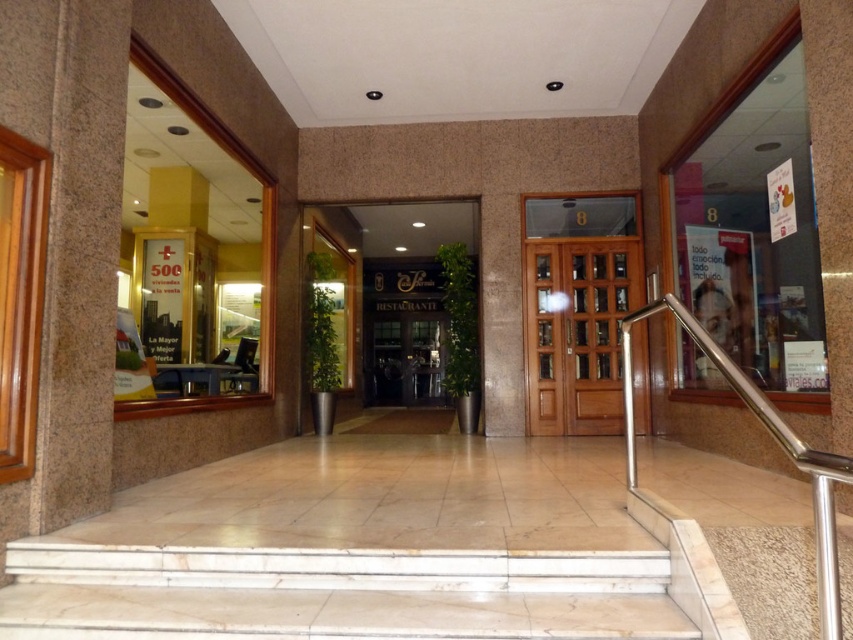
Question: Among these objects, which one is nearest to the camera?

Choices:
 (A) dark brown wooden door at center
 (B) granite pillar at left
 (C) polished stainless steel handrail at right

Answer: (C)

Question: Among these points, which one is nearest to the camera?

Choices:
 (A) (540, 428)
 (B) (761, 420)
 (C) (368, 332)
 (D) (70, 29)

Answer: (B)

Question: Observing the image, what is the correct spatial positioning of granite pillar at left in reference to mahogany wood door at center?

Choices:
 (A) left
 (B) right

Answer: (A)

Question: Which object is farther from the camera taking this photo?

Choices:
 (A) mahogany wood door at center
 (B) polished stainless steel handrail at right
 (C) granite pillar at left
 (D) dark brown wooden door at center

Answer: (D)

Question: Is granite pillar at left below mahogany wood door at center?

Choices:
 (A) yes
 (B) no

Answer: (B)

Question: Can you confirm if mahogany wood door at center is thinner than polished stainless steel handrail at right?

Choices:
 (A) yes
 (B) no

Answer: (B)